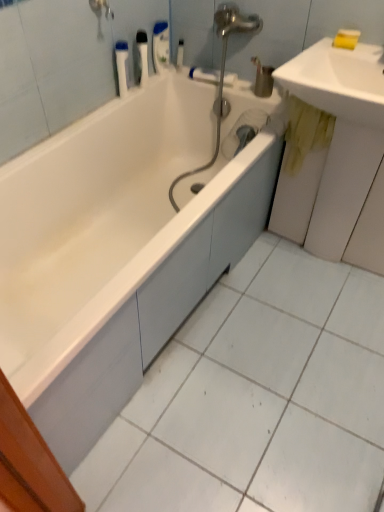
Question: Is white plastic bottle at upper center, which is counted as the 3th toiletry, starting from the left, situated inside yellow stained wood at right or outside?

Choices:
 (A) inside
 (B) outside

Answer: (B)

Question: Considering the positions of point (157, 27) and point (327, 152), is point (157, 27) closer or farther from the camera than point (327, 152)?

Choices:
 (A) closer
 (B) farther

Answer: (B)

Question: Which object is positioned farthest from the white plastic bottle at upper center, the 3th toiletry from the right?

Choices:
 (A) white plastic bottle at upper center, which is counted as the 1th toiletry, starting from the right
 (B) white glossy sink at upper right
 (C) white glossy bathtub at center
 (D) yellow stained wood at right
 (E) matte silver faucet at center

Answer: (D)

Question: Considering the real-world distances, which object is farthest from the white plastic container at upper left, which is the 1th toiletry in left-to-right order?

Choices:
 (A) white plastic bottle at upper center, which is counted as the 1th toiletry, starting from the right
 (B) matte silver faucet at center
 (C) white plastic bottle at upper center, which is counted as the 3th toiletry, starting from the left
 (D) white glossy sink at upper right
 (E) white plastic bottle at upper center, the 2th toiletry viewed from the left

Answer: (D)